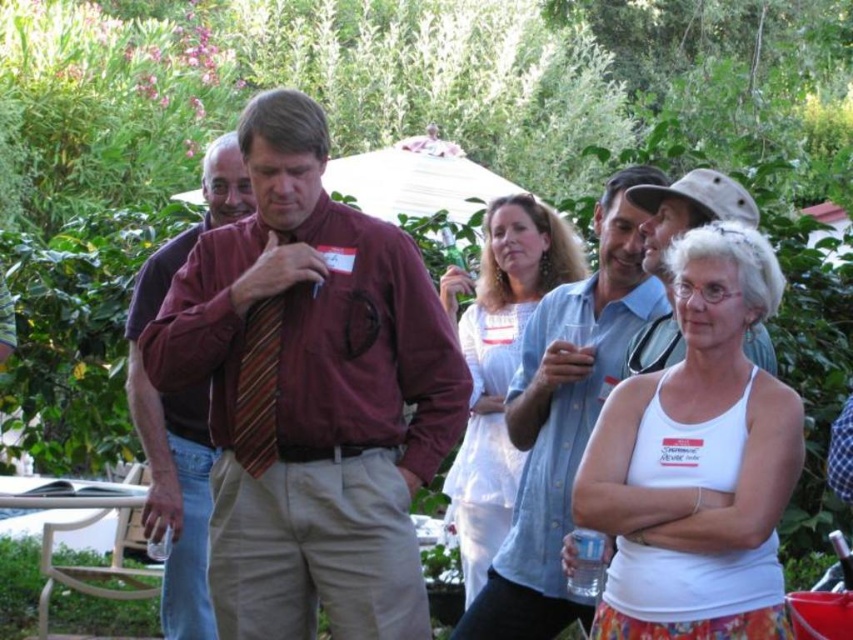
Who is positioned more to the right, maroon fabric shirt at center or striped tie at center?

maroon fabric shirt at center

How distant is maroon fabric shirt at center from striped tie at center?

They are 3.48 feet apart.

Is point (395, 346) closer to viewer compared to point (144, 305)?

Yes, point (395, 346) is closer to viewer.

Locate an element on the screen. This screenshot has width=853, height=640. maroon fabric shirt at center is located at coordinates (311, 394).

Does striped tie at center appear over striped fabric tie at center?

Actually, striped tie at center is below striped fabric tie at center.

Does striped tie at center have a lesser height compared to striped fabric tie at center?

No, striped tie at center is not shorter than striped fabric tie at center.

Which is in front, point (184, 259) or point (274, 349)?

Point (274, 349) is more forward.

Where is `striped tie at center`? Image resolution: width=853 pixels, height=640 pixels. striped tie at center is located at coordinates (181, 412).

Image resolution: width=853 pixels, height=640 pixels. What do you see at coordinates (311, 394) in the screenshot?
I see `maroon fabric shirt at center` at bounding box center [311, 394].

Is maroon fabric shirt at center above white tank top at center?

Indeed, maroon fabric shirt at center is positioned over white tank top at center.

Is point (308, 195) positioned in front of point (727, 508)?

That is False.

This screenshot has height=640, width=853. I want to click on maroon fabric shirt at center, so click(x=311, y=394).